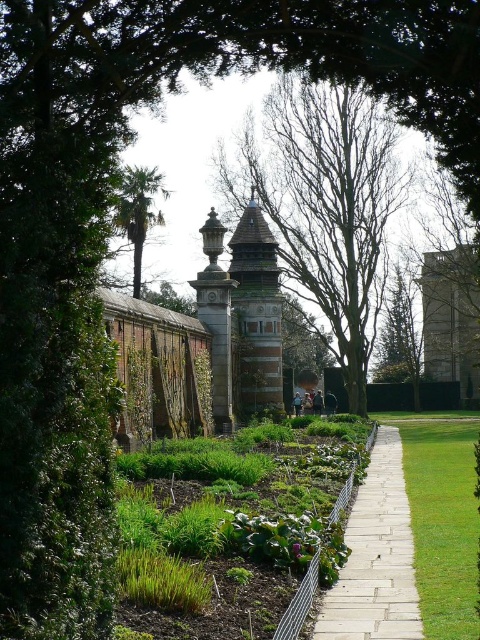
Is brown stone tower at center shorter than stone lantern at center?

No, brown stone tower at center is not shorter than stone lantern at center.

Looking at this image, is brown stone tower at center to the right of stone lantern at center from the viewer's perspective?

Yes, brown stone tower at center is to the right of stone lantern at center.

Is point (275, 244) farther from viewer compared to point (199, 301)?

That is True.

Where is `brown stone tower at center`? brown stone tower at center is located at coordinates (256, 312).

Which is in front, point (385, 490) or point (228, 356)?

Point (385, 490) is in front.

The image size is (480, 640). What do you see at coordinates (375, 557) in the screenshot?
I see `white stone path at center` at bounding box center [375, 557].

Who is more distant from viewer, (402, 576) or (227, 330)?

Point (227, 330)

Image resolution: width=480 pixels, height=640 pixels. Find the location of `white stone path at center`. white stone path at center is located at coordinates (375, 557).

Is point (285, 596) positioned behind point (222, 275)?

No, it is not.

Is point (326, 564) farther from viewer compared to point (216, 307)?

No, it is in front of (216, 307).

You are a GUI agent. You are given a task and a screenshot of the screen. Output one action in this format:
    pyautogui.click(x=<x>, y=<y>)
    Task: Click on the green leafy garden at center
    The image size is (480, 640).
    Given the screenshot: What is the action you would take?
    pyautogui.click(x=232, y=545)